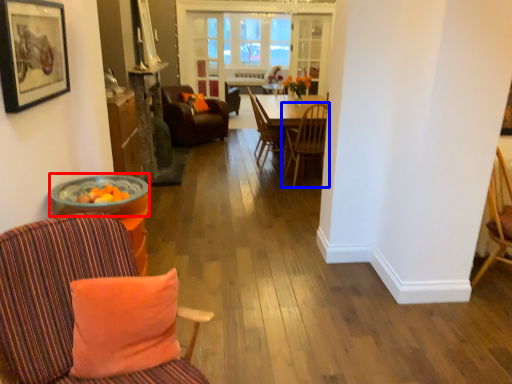
Question: Which of the following is the farthest to the observer, round table (highlighted by a red box) or chair (highlighted by a blue box)?

Choices:
 (A) round table
 (B) chair

Answer: (B)